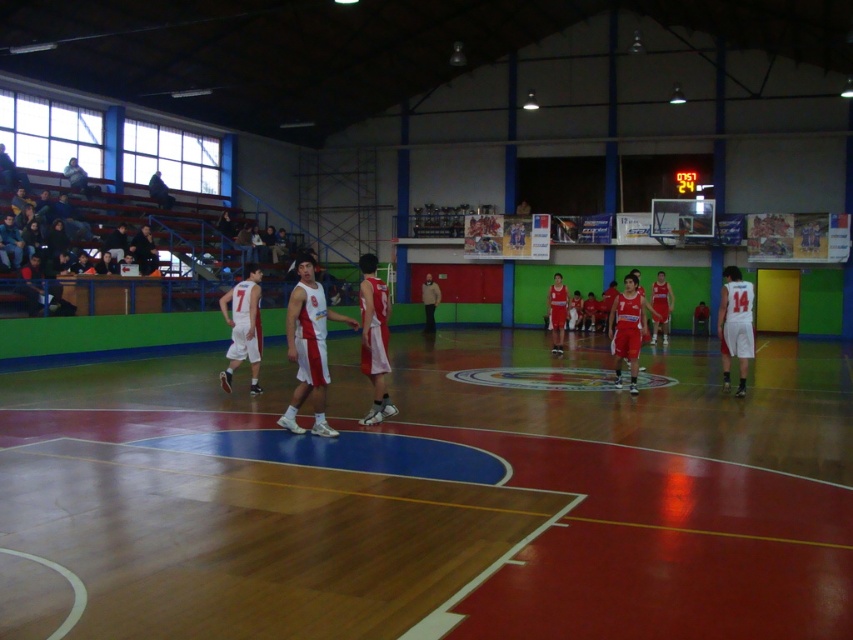
Does red jersey basketball player at center have a greater width compared to matte black jacket at upper left?

Indeed, red jersey basketball player at center has a greater width compared to matte black jacket at upper left.

In the scene shown: Who is higher up, red jersey basketball player at center or matte black jacket at upper left?

matte black jacket at upper left

Who is more distant from viewer, (x=374, y=323) or (x=80, y=180)?

Point (x=80, y=180)

Where is `red jersey basketball player at center`? red jersey basketball player at center is located at coordinates (374, 339).

In the scene shown: How much distance is there between wooden floor at center and light brown leather jacket at center?

61.01 feet

I want to click on wooden floor at center, so click(442, 497).

Is point (425, 552) positioned in front of point (431, 305)?

Yes.

Identify the location of wooden floor at center. Image resolution: width=853 pixels, height=640 pixels. (442, 497).

Can you confirm if white matte basketball jersey at center is smaller than white matte basketball player at right?

Actually, white matte basketball jersey at center might be larger than white matte basketball player at right.

In order to click on white matte basketball jersey at center in this screenshot , I will do `click(309, 348)`.